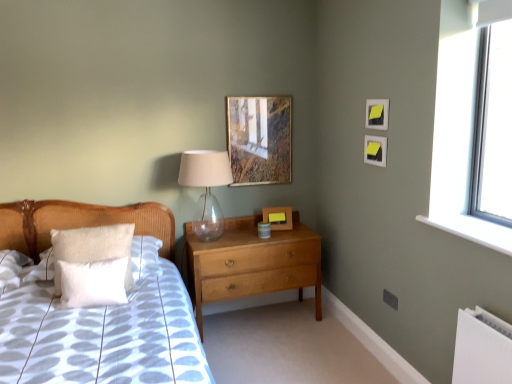
Question: Which direction should I rotate to look at light brown wood chest of drawers at center?

Choices:
 (A) right
 (B) left

Answer: (B)

Question: From the image's perspective, does transparent plastic window screen at upper right appear higher than yellow paper picture frame at upper right, the 3th picture frame positioned from the back?

Choices:
 (A) yes
 (B) no

Answer: (A)

Question: Does transparent plastic window screen at upper right have a greater height compared to yellow paper picture frame at upper right, the 3th picture frame positioned from the back?

Choices:
 (A) yes
 (B) no

Answer: (A)

Question: Is transparent plastic window screen at upper right with yellow paper picture frame at upper right, acting as the first picture frame starting from the right?

Choices:
 (A) no
 (B) yes

Answer: (A)

Question: Is transparent plastic window screen at upper right to the left of yellow paper picture frame at upper right, marked as the 4th picture frame in a left-to-right arrangement, from the viewer's perspective?

Choices:
 (A) yes
 (B) no

Answer: (B)

Question: Considering the relative positions of transparent plastic window screen at upper right and yellow paper picture frame at upper right, the 3th picture frame positioned from the back, in the image provided, is transparent plastic window screen at upper right in front of yellow paper picture frame at upper right, the 3th picture frame positioned from the back,?

Choices:
 (A) yes
 (B) no

Answer: (A)

Question: Is transparent plastic window screen at upper right surrounding yellow paper picture frame at upper right, arranged as the 2th picture frame when viewed from the front?

Choices:
 (A) yes
 (B) no

Answer: (B)

Question: Does matte yellow picture frame at upper right, positioned as the fourth picture frame in back-to-front order, appear on the left side of yellow paper picture frame at upper right, acting as the first picture frame starting from the right?

Choices:
 (A) yes
 (B) no

Answer: (A)

Question: Considering the relative sizes of matte yellow picture frame at upper right, marked as the 1th picture frame in a front-to-back arrangement, and yellow paper picture frame at upper right, arranged as the 2th picture frame when viewed from the front, in the image provided, is matte yellow picture frame at upper right, marked as the 1th picture frame in a front-to-back arrangement, smaller than yellow paper picture frame at upper right, arranged as the 2th picture frame when viewed from the front,?

Choices:
 (A) yes
 (B) no

Answer: (A)

Question: Does matte yellow picture frame at upper right, which is counted as the third picture frame, starting from the left, have a lesser height compared to yellow paper picture frame at upper right, marked as the 4th picture frame in a left-to-right arrangement?

Choices:
 (A) no
 (B) yes

Answer: (A)

Question: Does matte yellow picture frame at upper right, which is counted as the third picture frame, starting from the left, have a greater height compared to yellow paper picture frame at upper right, the 3th picture frame positioned from the back?

Choices:
 (A) no
 (B) yes

Answer: (B)

Question: Does matte yellow picture frame at upper right, which is counted as the third picture frame, starting from the left, have a lesser width compared to yellow paper picture frame at upper right, marked as the 4th picture frame in a left-to-right arrangement?

Choices:
 (A) no
 (B) yes

Answer: (B)

Question: Is matte yellow picture frame at upper right, positioned as the fourth picture frame in back-to-front order, to the right of yellow paper picture frame at upper right, arranged as the 2th picture frame when viewed from the front, from the viewer's perspective?

Choices:
 (A) yes
 (B) no

Answer: (B)

Question: Can you confirm if white fluffy pillow at left, marked as the second pillow in a back-to-front arrangement, is shorter than transparent plastic window screen at upper right?

Choices:
 (A) yes
 (B) no

Answer: (A)